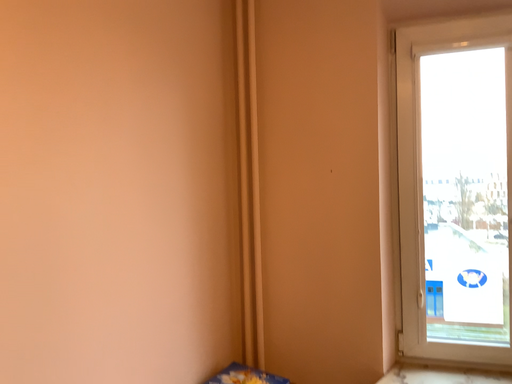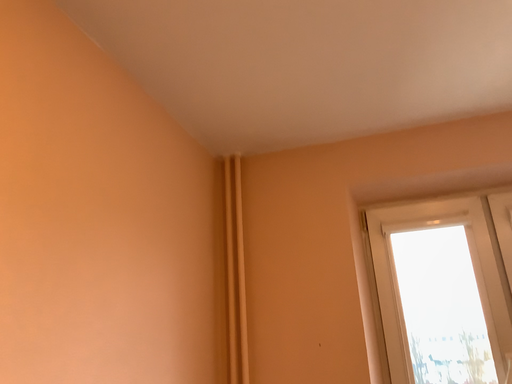
Question: How did the camera likely rotate when shooting the video?

Choices:
 (A) rotated downward
 (B) rotated upward

Answer: (B)